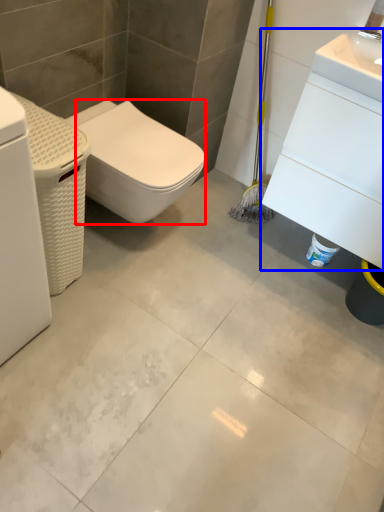
Question: Among these objects, which one is nearest to the camera, bidet (highlighted by a red box) or porcelain (highlighted by a blue box)?

Choices:
 (A) bidet
 (B) porcelain

Answer: (B)